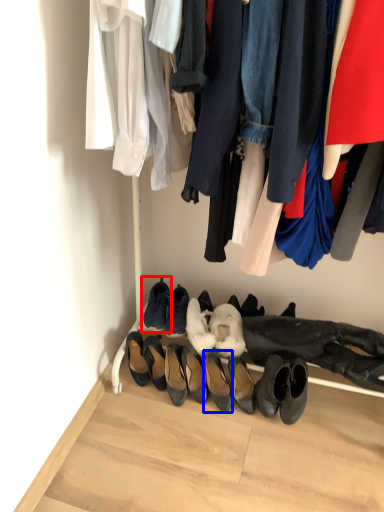
Question: Among these objects, which one is nearest to the camera, footwear (highlighted by a red box) or footwear (highlighted by a blue box)?

Choices:
 (A) footwear
 (B) footwear

Answer: (B)